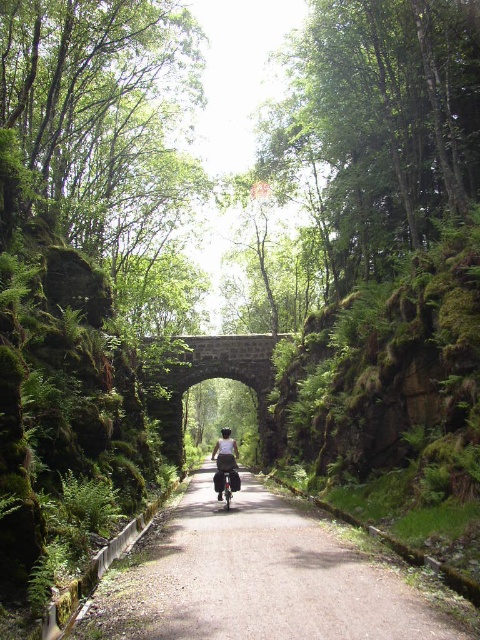
You are standing at the camera position and want to reach the point marked at coordinates (x=175, y=384) in the image. The path is narrow and flanked by dense trees. Can you estimate how far you need to walk to reach that point?

The point marked at coordinates (x=175, y=384) is 141.01 meters away from the camera, so you need to walk approximately 141.01 meters to reach it.

You are a cyclist riding along a forest path. You notice a stone archway at center and a white fabric shirt at center ahead. Which object is wider from your perspective?

The stone archway at center is wider than the white fabric shirt at center from your perspective.

You are a cyclist approaching the gravel road at center and the stone archway at center. Which object will you encounter first as you move forward?

The gravel road at center is positioned under the stone archway at center, so you will encounter the gravel road at center first before reaching the stone archway at center.